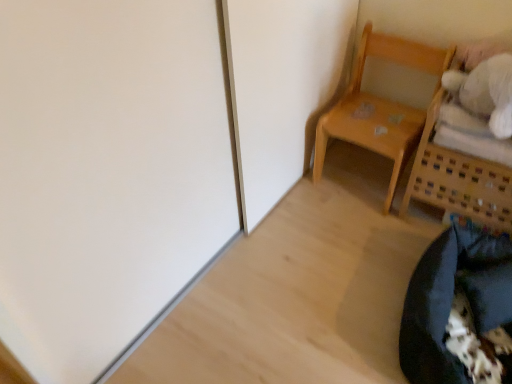
You are a GUI agent. You are given a task and a screenshot of the screen. Output one action in this format:
    pyautogui.click(x=<x>, y=<y>)
    Task: Click on the vacant space underneath light wood chair at upper right, the first furniture when ordered from left to right (from a real-world perspective)
    
    Given the screenshot: What is the action you would take?
    360,172